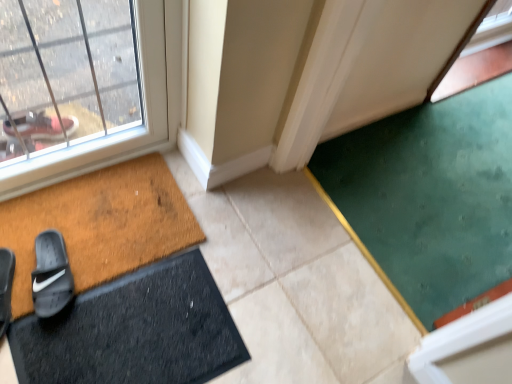
At what (x,y) coordinates should I click in order to perform the action: click on vacant space behind black rubber slide at lower left, which is the second footwear in left-to-right order. Please return your answer as a coordinate pair (x, y). This screenshot has width=512, height=384. Looking at the image, I should click on (81, 220).